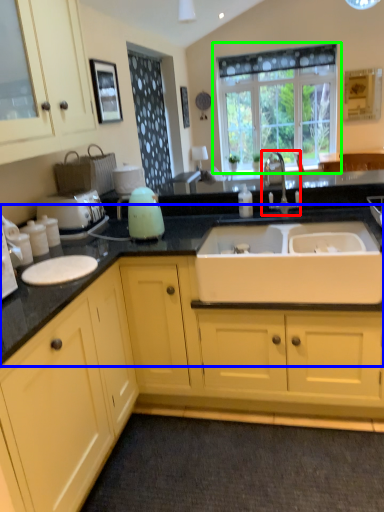
Question: Considering the real-world distances, which object is closest to tap (highlighted by a red box)? countertop (highlighted by a blue box) or window (highlighted by a green box).

Choices:
 (A) countertop
 (B) window

Answer: (A)